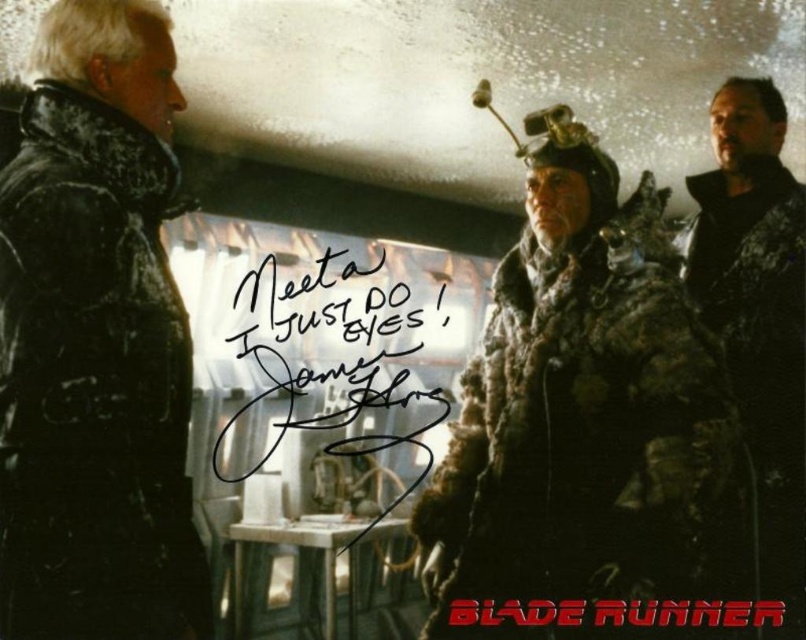
Question: Which of the following is the farthest from the observer?

Choices:
 (A) red plastic text at center
 (B) black textured coat at left

Answer: (A)

Question: Which point appears closest to the camera in this image?

Choices:
 (A) (30, 317)
 (B) (543, 289)
 (C) (707, 609)
 (D) (422, 305)

Answer: (A)

Question: From the image, what is the correct spatial relationship of fuzzy fur coat at center in relation to camouflage jacket at right?

Choices:
 (A) right
 (B) left

Answer: (B)

Question: Can you confirm if camouflage jacket at right is bigger than red plastic text at center?

Choices:
 (A) no
 (B) yes

Answer: (B)

Question: Which object is farther from the camera taking this photo?

Choices:
 (A) fuzzy fur coat at center
 (B) red plastic text at center

Answer: (B)

Question: Does black ink writing at center have a greater width compared to red plastic text at center?

Choices:
 (A) yes
 (B) no

Answer: (A)